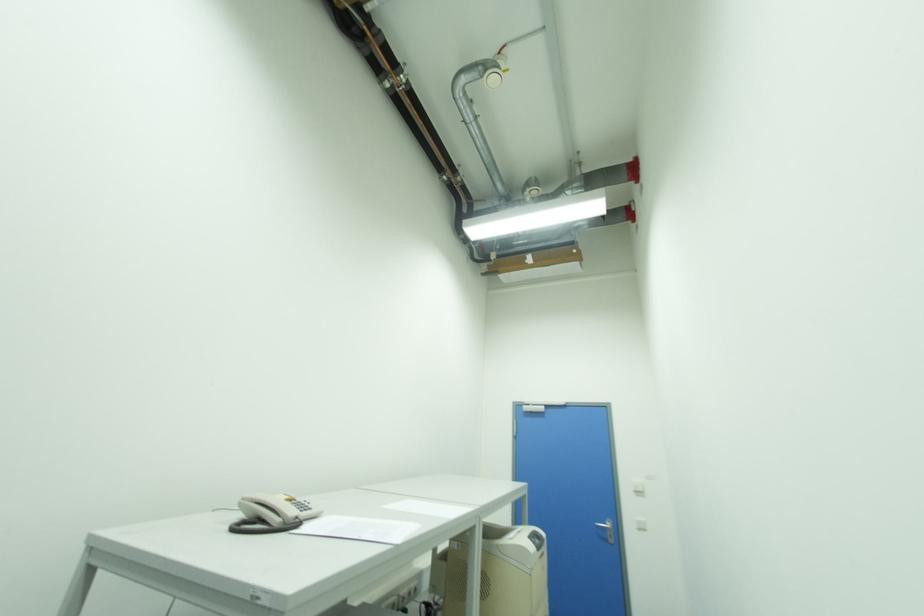
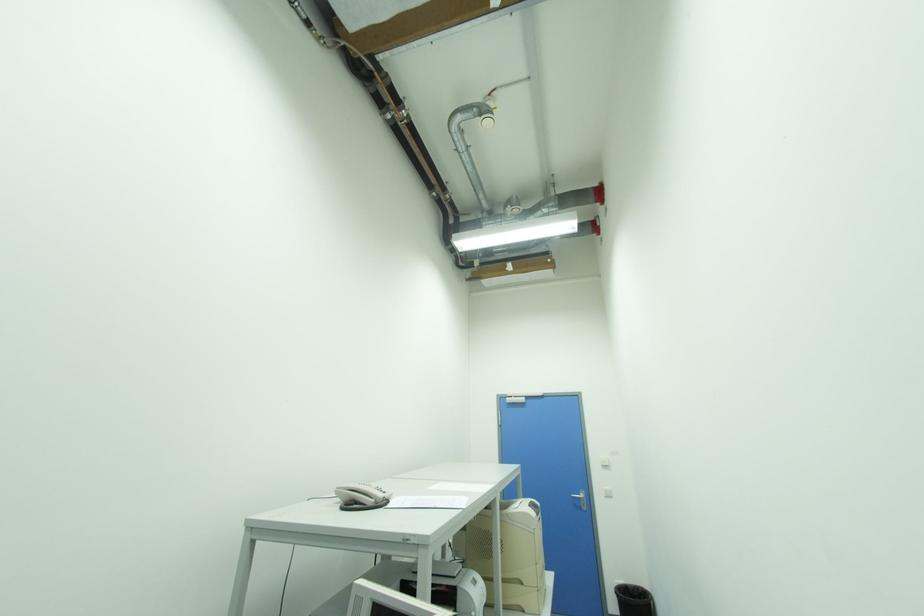
Question: The camera is either moving clockwise (left) or counter-clockwise (right) around the object. The first image is from the beginning of the video and the second image is from the end. Is the camera moving left or right when shooting the video?

Choices:
 (A) Left
 (B) Right

Answer: (A)